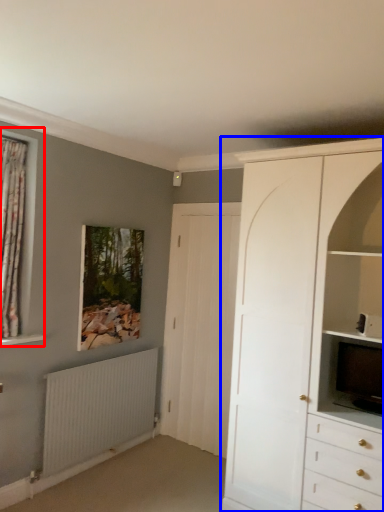
Question: Which of the following is the farthest to the observer, window (highlighted by a red box) or cabinetry (highlighted by a blue box)?

Choices:
 (A) window
 (B) cabinetry

Answer: (A)